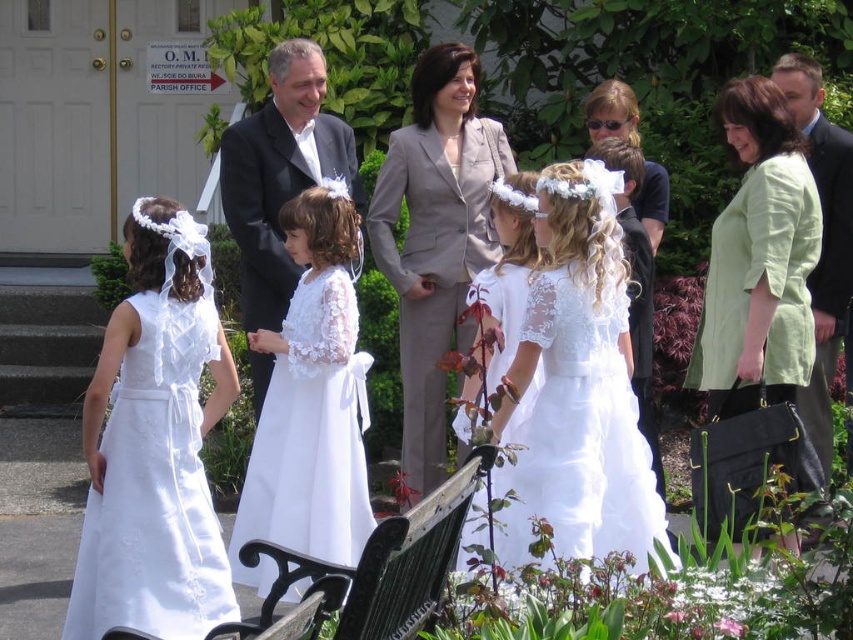
Which is above, white satin dress at left or white satin dress at center?

Positioned higher is white satin dress at center.

What do you see at coordinates (154, 492) in the screenshot? I see `white satin dress at left` at bounding box center [154, 492].

Is point (126, 524) positioned before point (302, 387)?

Yes, it is.

Identify the location of white satin dress at left. (154, 492).

How far apart are white satin dress at left and black wrought iron bench at lower center?

white satin dress at left is 1.49 meters from black wrought iron bench at lower center.

Locate an element on the screen. The width and height of the screenshot is (853, 640). white satin dress at left is located at coordinates (154, 492).

Is point (177, 548) closer to viewer compared to point (401, 625)?

No.

The width and height of the screenshot is (853, 640). What are the coordinates of `white satin dress at left` in the screenshot? It's located at (154, 492).

Who is positioned more to the right, white satin dress at left or green fabric jacket at upper right?

green fabric jacket at upper right

Describe the element at coordinates (154, 492) in the screenshot. I see `white satin dress at left` at that location.

Describe the element at coordinates (154, 492) in the screenshot. I see `white satin dress at left` at that location.

The height and width of the screenshot is (640, 853). I want to click on white satin dress at left, so click(154, 492).